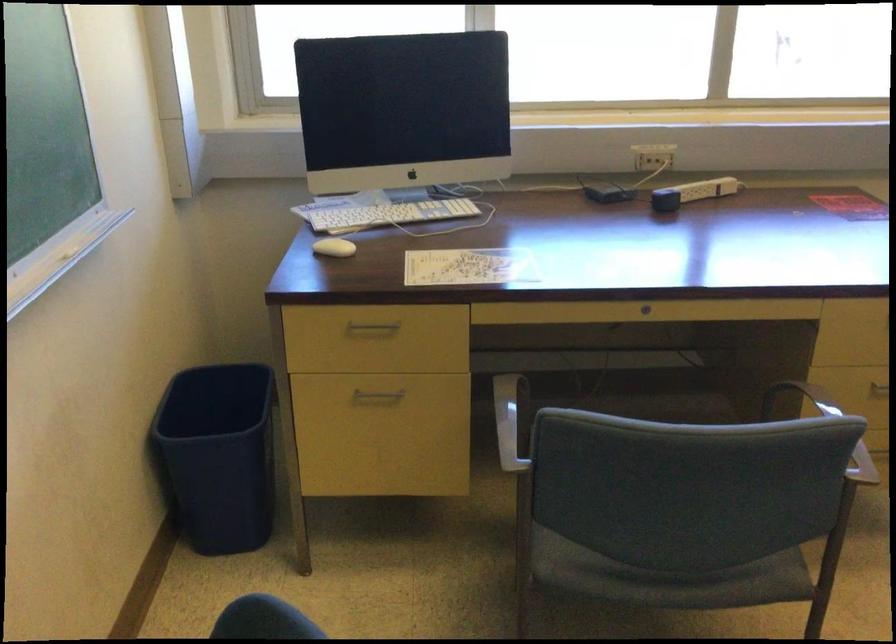
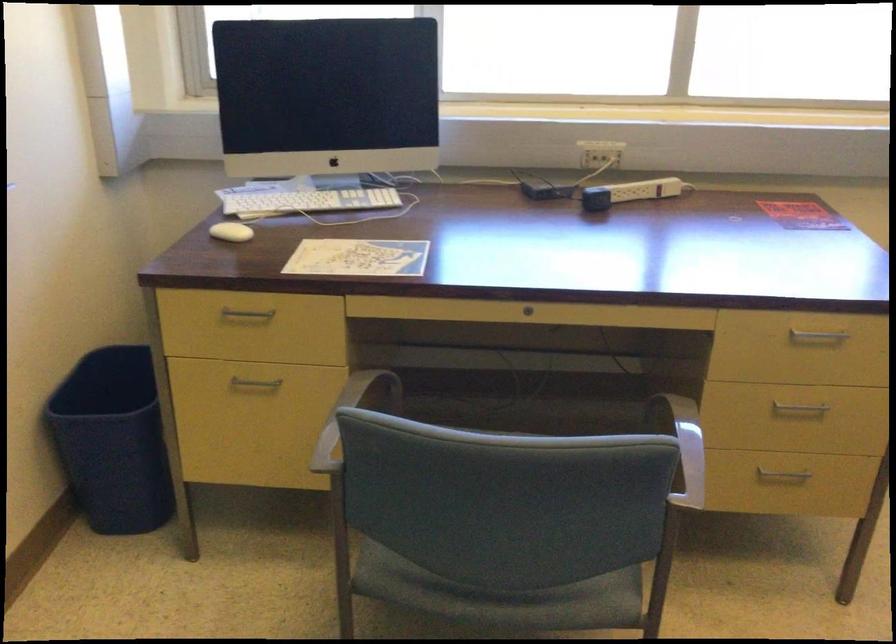
The point at (374, 393) is marked in the first image. Where is the corresponding point in the second image?

(254, 384)